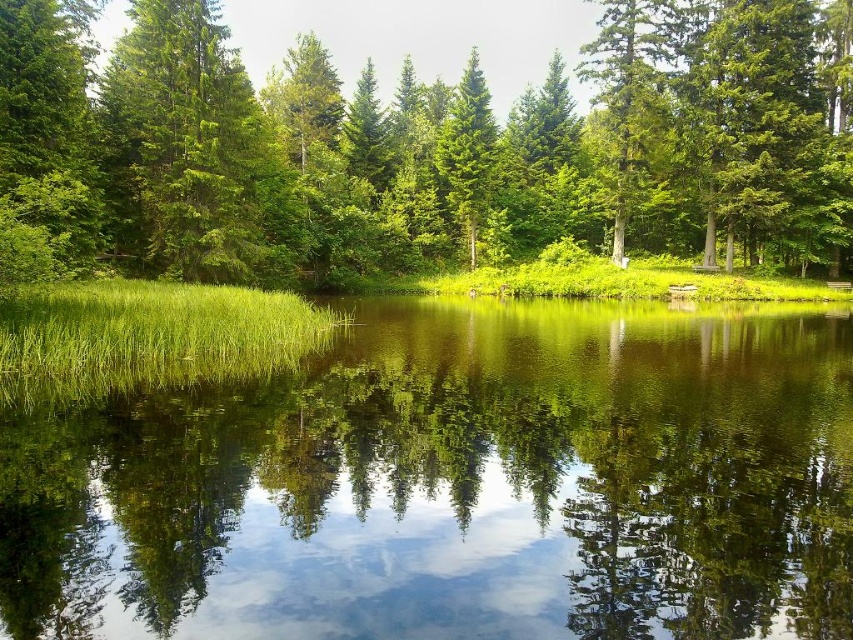
You are a hiker who wants to cross the green grassy lake at center to reach the green matte tree at center. The lake is frozen in winter. Can you safely walk across the lake to the tree if the minimum safe ice thickness is 15 cm and the ice here is 12 cm thick?

The distance between the green grassy lake at center and the green matte tree at center is 33.47 meters, but the ice thickness is only 12 cm, which is below the required 15 cm for safe crossing. Therefore, you cannot safely walk across the lake to the tree.

From the picture: You are an environmental scientist analyzing the pond ecosystem. You notice two trees at the center of the image, a green leafy tree at center and a green matte tree at center. Which tree has a larger canopy area?

The green leafy tree at center has a larger canopy area than the green matte tree at center according to the description.

You are standing at the edge of the green grassy lake at center and want to walk to the green leafy tree at center. Considering the width of the lake and the tree, which one would you have to cross or walk around first?

The green grassy lake at center has a width less than the green leafy tree at center, so you would have to cross or walk around the green grassy lake at center first before reaching the green leafy tree at center.